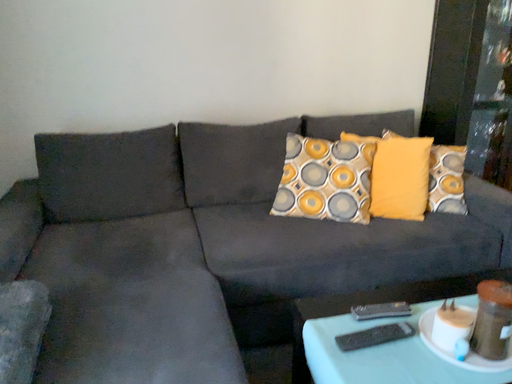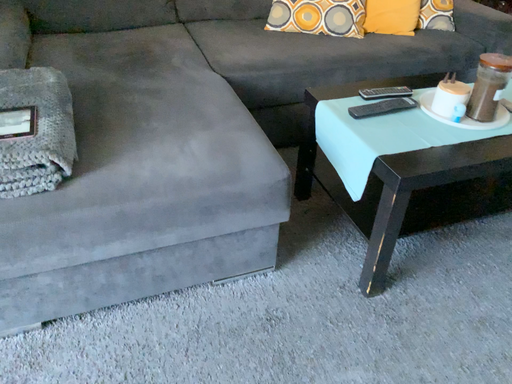
Question: How did the camera likely rotate when shooting the video?

Choices:
 (A) rotated downward
 (B) rotated upward

Answer: (A)